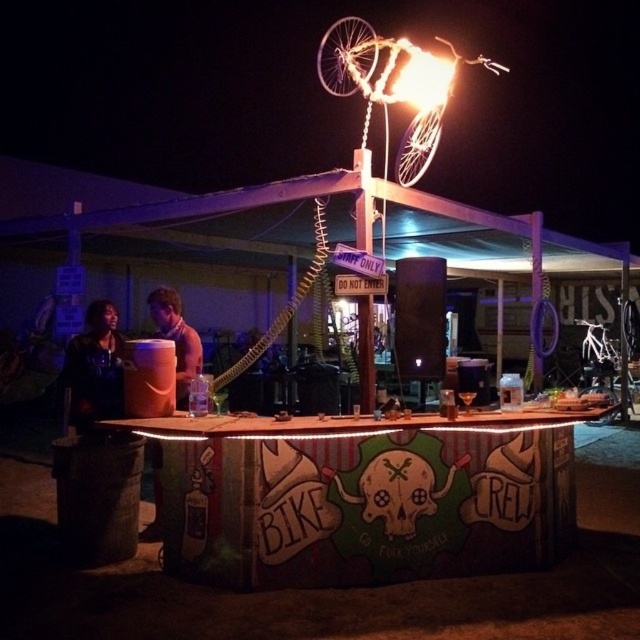
Consider the image. You are standing in front of the bar at the festival. You notice two points marked in the scene. The first point is at coordinates point (x=118, y=404) and the second is at point (x=609, y=419). Which point is closer to your current position?

Point (x=118, y=404) is closer to the camera than point (x=609, y=419), so the first point is closer to your current position.